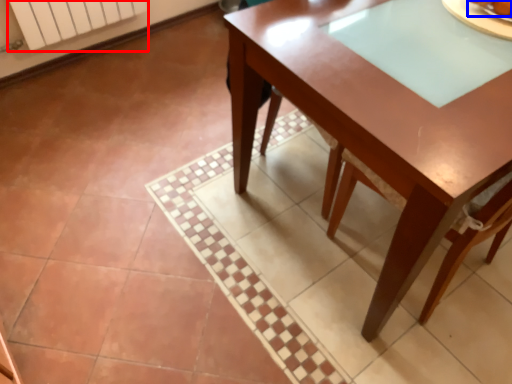
Question: Which point is closer to the camera, radiator (highlighted by a red box) or food (highlighted by a blue box)?

Choices:
 (A) radiator
 (B) food

Answer: (B)